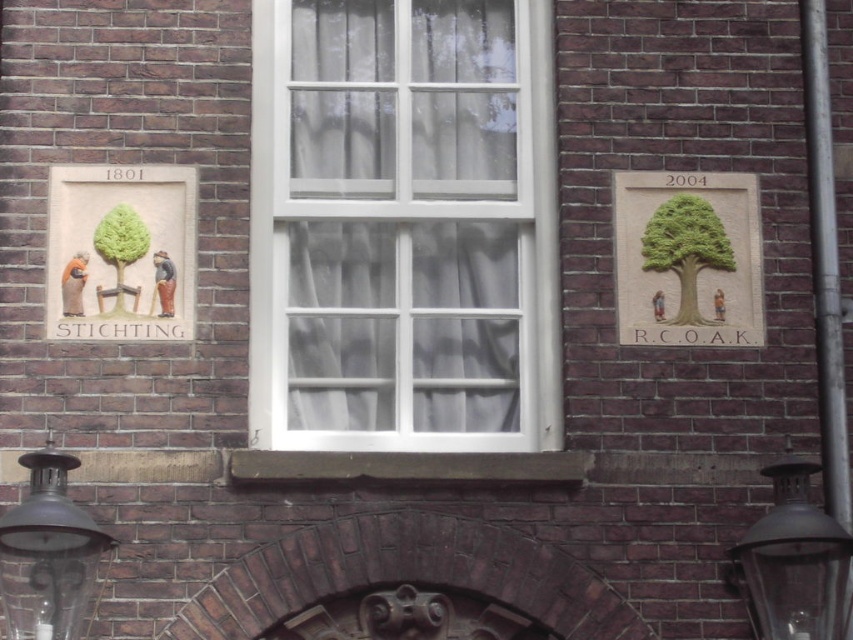
Question: Which point is closer to the camera?

Choices:
 (A) green stone tree at upper right
 (B) green matte tree at left
 (C) green matte tree at right

Answer: (B)

Question: Which point is farther from the camera taking this photo?

Choices:
 (A) (86, 579)
 (B) (151, 234)
 (C) (679, 289)

Answer: (C)

Question: Is green matte tree at right below green matte tree at left?

Choices:
 (A) yes
 (B) no

Answer: (B)

Question: Is black glass lamp at lower right below green matte tree at right?

Choices:
 (A) yes
 (B) no

Answer: (A)

Question: Can you confirm if green stone tree at upper right is positioned to the right of green matte tree at right?

Choices:
 (A) yes
 (B) no

Answer: (B)

Question: Which of the following is the closest to the observer?

Choices:
 (A) white glass window at center
 (B) green matte tree at right
 (C) matte beige plaque at left

Answer: (C)